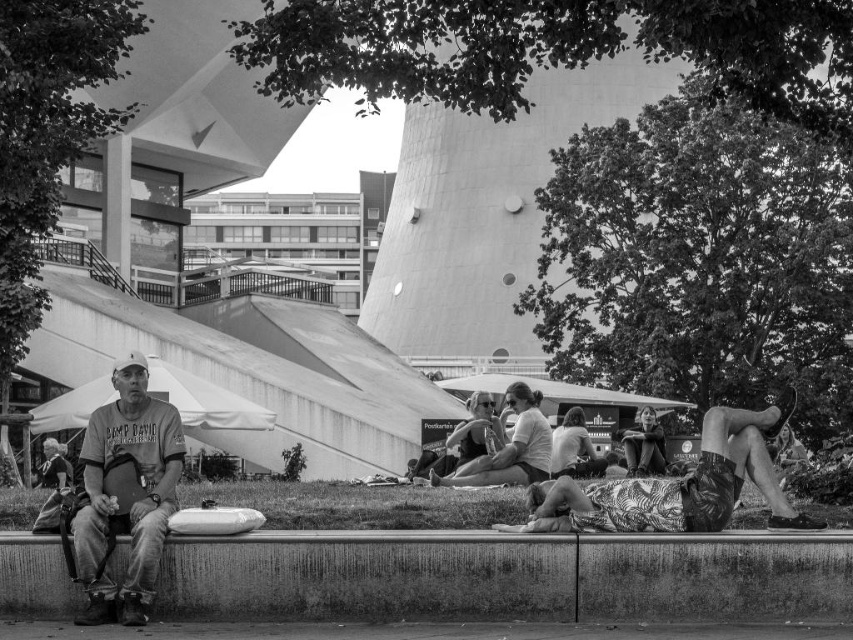
Question: Considering the real-world distances, which object is closest to the smooth concrete curb at lower center?

Choices:
 (A) matte white shirt at center
 (B) matte gray t-shirt at left
 (C) printed fabric shorts at center

Answer: (C)

Question: Does smooth concrete curb at lower center have a larger size compared to matte white shirt at center?

Choices:
 (A) yes
 (B) no

Answer: (B)

Question: Which object is closer to the camera taking this photo?

Choices:
 (A) smooth concrete curb at lower center
 (B) matte white shirt at center
 (C) matte gray t-shirt at left

Answer: (C)

Question: Is smooth concrete curb at lower center wider than matte white shirt at center?

Choices:
 (A) no
 (B) yes

Answer: (B)

Question: Is smooth concrete curb at lower center below matte white shirt at center?

Choices:
 (A) yes
 (B) no

Answer: (A)

Question: Which point is closer to the camera taking this photo?

Choices:
 (A) (93, 461)
 (B) (838, 595)

Answer: (B)